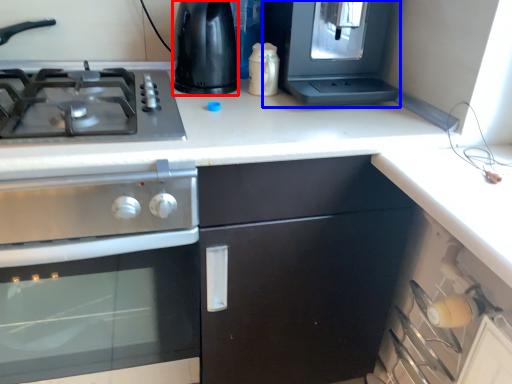
Question: Which point is further to the camera, appliance (highlighted by a red box) or appliance (highlighted by a blue box)?

Choices:
 (A) appliance
 (B) appliance

Answer: (A)